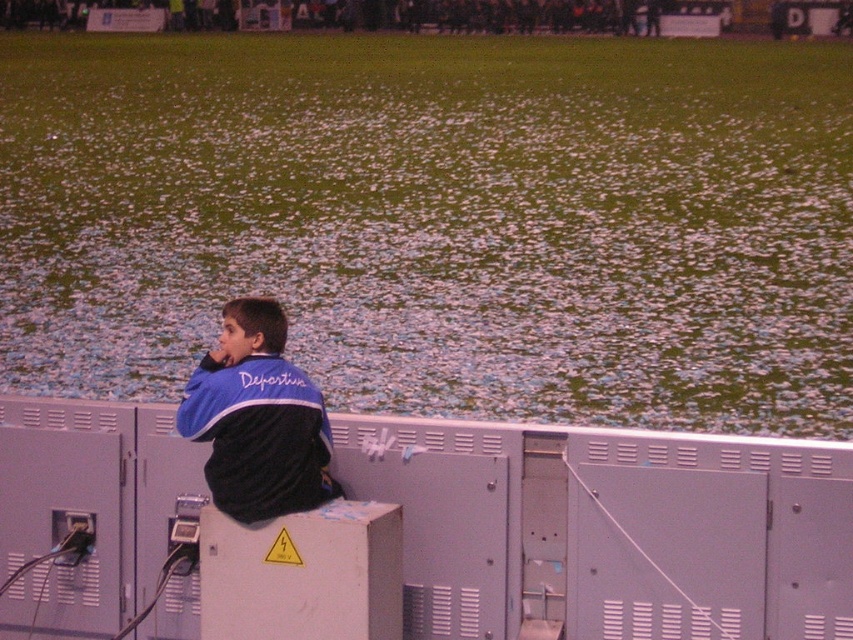
Question: Is the position of green grass at center less distant than that of blue fleece jacket at upper left?

Choices:
 (A) yes
 (B) no

Answer: (B)

Question: Is green grass at center bigger than blue fleece jacket at upper left?

Choices:
 (A) no
 (B) yes

Answer: (B)

Question: Which point is farther to the camera?

Choices:
 (A) green grass at center
 (B) blue fleece jacket at upper left

Answer: (A)

Question: Among these objects, which one is nearest to the camera?

Choices:
 (A) green grass at center
 (B) blue fleece jacket at upper left

Answer: (B)

Question: Is green grass at center to the left of blue fleece jacket at upper left from the viewer's perspective?

Choices:
 (A) yes
 (B) no

Answer: (B)